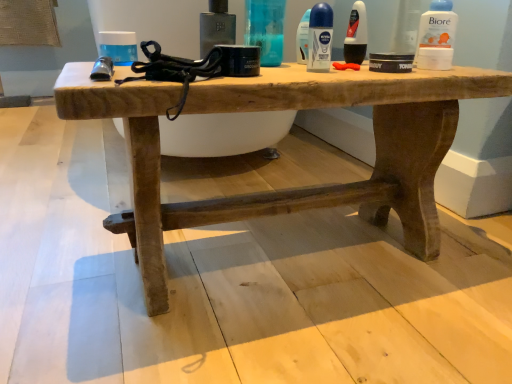
Where is `vacant area that is in front of matte black deodorant at center, placed as the first toiletry when sorted from right to left`? vacant area that is in front of matte black deodorant at center, placed as the first toiletry when sorted from right to left is located at coordinates [x=361, y=67].